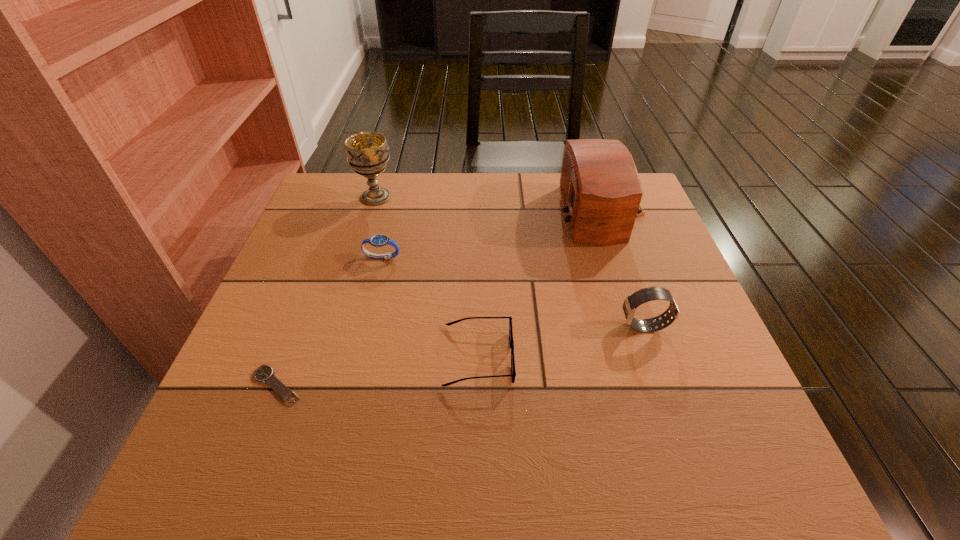
This screenshot has width=960, height=540. In the image, there is a desktop. Identify the location of free space at the left edge. (321, 262).

The height and width of the screenshot is (540, 960). What are the coordinates of `vacant space at the right edge of the desktop` in the screenshot? It's located at (652, 359).

This screenshot has height=540, width=960. I want to click on free space at the far left corner of the desktop, so click(348, 192).

Find the location of a particular element. The height and width of the screenshot is (540, 960). vacant region at the near left corner is located at coordinates (284, 436).

In order to click on vacant space at the far right corner of the desktop in this screenshot , I will do `click(646, 199)`.

In order to click on unoccupied position between the second nearest watch and the radio receiver in this screenshot , I will do `click(623, 269)`.

Find the location of a particular element. vacant space that is in between the radio receiver and the chalice is located at coordinates (489, 205).

This screenshot has width=960, height=540. Find the location of `blank region between the chalice and the radio receiver`. blank region between the chalice and the radio receiver is located at coordinates (489, 205).

Where is `vacant space that's between the fifth tallest object and the shortest object`? This screenshot has height=540, width=960. vacant space that's between the fifth tallest object and the shortest object is located at coordinates (377, 371).

Identify the location of blank region between the shortest object and the chalice. (326, 291).